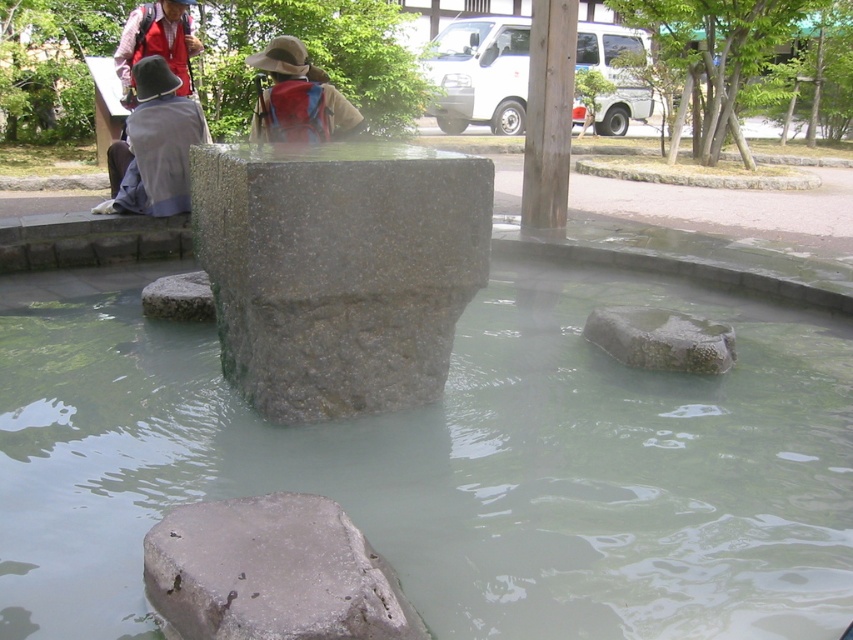
Question: Does gray rough stone at lower center have a larger size compared to red backpack at upper center?

Choices:
 (A) no
 (B) yes

Answer: (A)

Question: Estimate the real-world distances between objects in this image. Which object is closer to the clear stone water at center?

Choices:
 (A) gray fabric hat at upper left
 (B) granite rock at center
 (C) red backpack at upper center

Answer: (B)

Question: Which object is closer to the camera taking this photo?

Choices:
 (A) granite rock at center
 (B) gray rough stone at lower center
 (C) red backpack at upper center

Answer: (B)

Question: Is gray granite stone at center bigger than gray rough stone at lower center?

Choices:
 (A) no
 (B) yes

Answer: (B)

Question: Which of the following is the farthest from the observer?

Choices:
 (A) pyautogui.click(x=259, y=314)
 (B) pyautogui.click(x=164, y=520)

Answer: (A)

Question: Does gray granite stone at center appear under gray fabric hat at upper left?

Choices:
 (A) yes
 (B) no

Answer: (A)